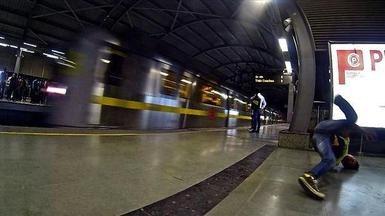
Image resolution: width=385 pixels, height=216 pixels. What are the coordinates of `lights` in the screenshot? It's located at (5, 45), (31, 43), (27, 48), (52, 57), (61, 51), (284, 44), (287, 65).